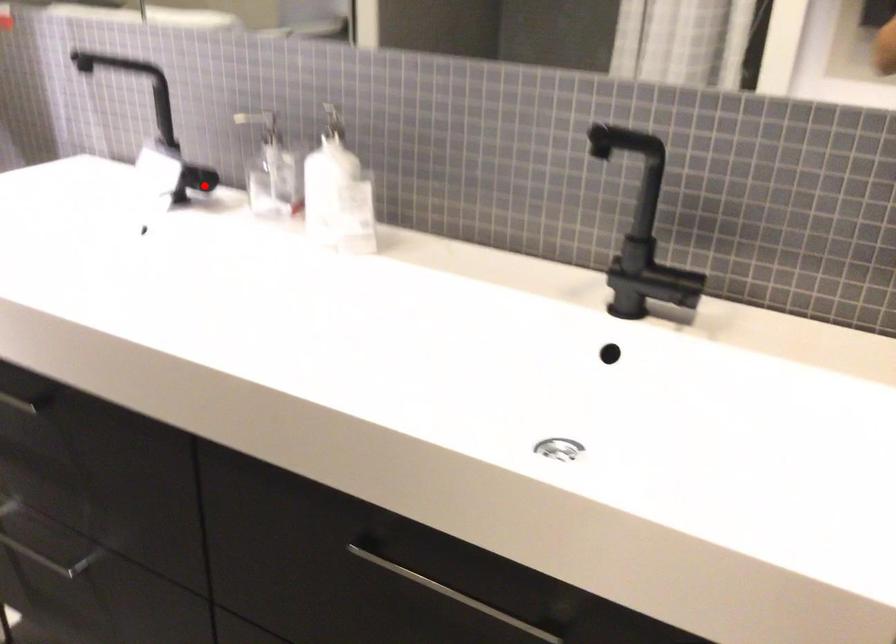
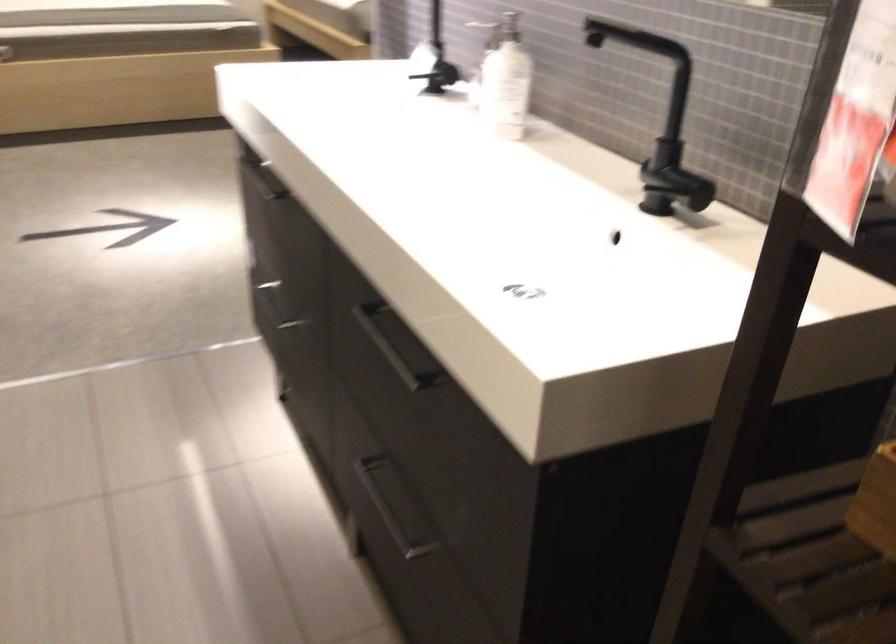
Question: I am providing you with two images of the same scene from different viewpoints. A red point is shown in image1. For the corresponding object point in image2, is it positioned nearer or farther from the camera?

Choices:
 (A) Nearer
 (B) Farther

Answer: (B)